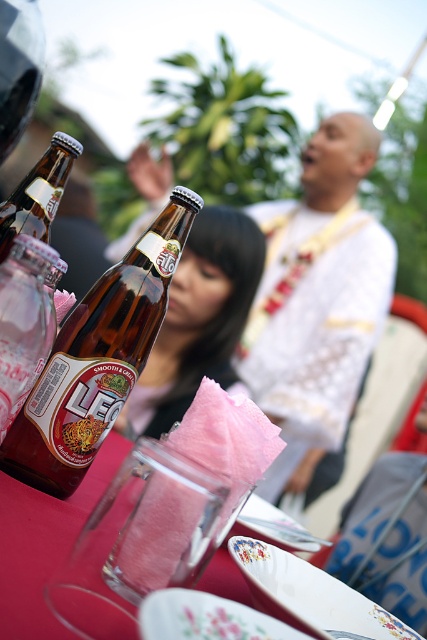
What are the coordinates of the smooth white shirt at center?

The smooth white shirt at center is located at coordinates point (316, 300).

You are at a fair and want to grab a snack. You see the pink cotton candy at center and the porcelain floral plate at center on the table. Which item is higher up?

The pink cotton candy at center is above the porcelain floral plate at center, so it is higher up.